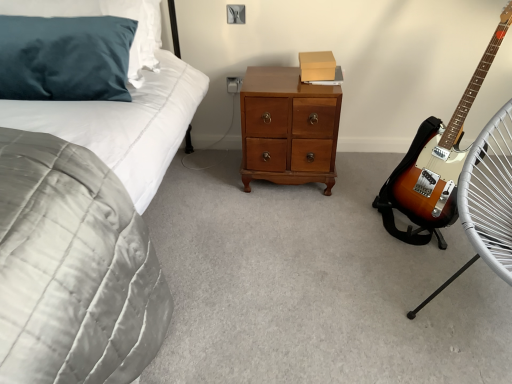
Question: Is white plastic electric outlet at center inside or outside of satin white folding chair at right?

Choices:
 (A) outside
 (B) inside

Answer: (A)

Question: From the image's perspective, is white plastic electric outlet at center above or below satin white folding chair at right?

Choices:
 (A) above
 (B) below

Answer: (A)

Question: Which object is positioned closest to the teal velvet pillow at upper left?

Choices:
 (A) velvet grey quilt at left
 (B) shiny brown wooden chest of drawers at center
 (C) satin white folding chair at right
 (D) white plastic electric outlet at center
 (E) satin wood guitar at right

Answer: (A)

Question: Estimate the real-world distances between objects in this image. Which object is closer to the shiny brown wooden chest of drawers at center?

Choices:
 (A) teal velvet pillow at upper left
 (B) satin white folding chair at right
 (C) velvet grey quilt at left
 (D) white plastic electric outlet at center
 (E) satin wood guitar at right

Answer: (D)